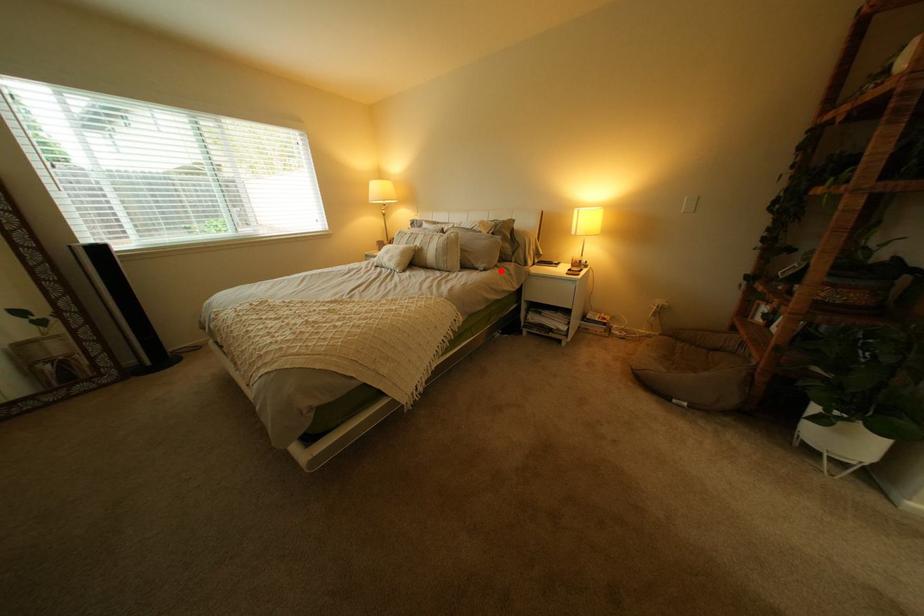
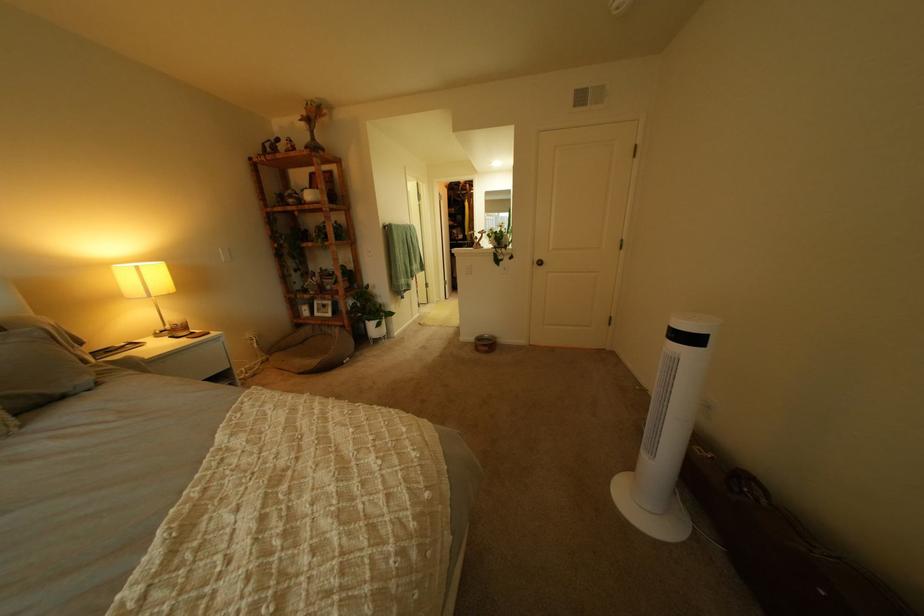
Locate, in the second image, the point that corresponds to the highlighted location in the first image.

(115, 385)